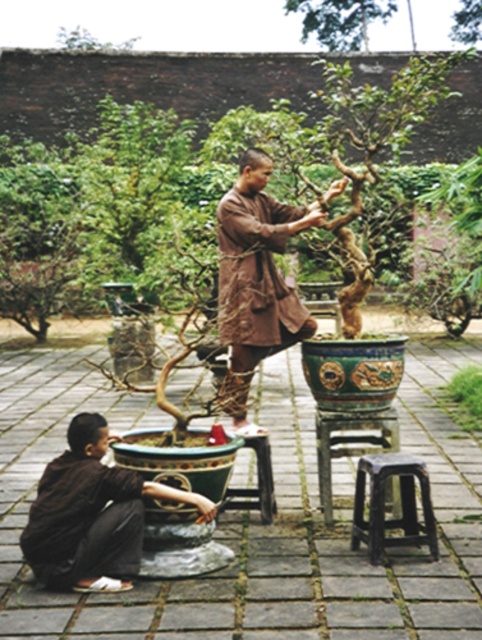
Question: Which of the following is the farthest from the observer?

Choices:
 (A) black plastic stool at lower center
 (B) brown matte/soft monk at center

Answer: (B)

Question: Which point is farther to the camera?

Choices:
 (A) (413, 467)
 (B) (53, 576)
 (C) (254, 451)

Answer: (C)

Question: Is black plastic stool at center positioned in front of wooden stool at center?

Choices:
 (A) yes
 (B) no

Answer: (B)

Question: Can you confirm if green glossy tree at upper center is thinner than wooden stool at center?

Choices:
 (A) yes
 (B) no

Answer: (B)

Question: Which object is closer to the camera taking this photo?

Choices:
 (A) matte brown robe at lower left
 (B) black plastic stool at center

Answer: (A)

Question: Is matte brown robe at lower left behind brown cotton robe at lower left?

Choices:
 (A) no
 (B) yes

Answer: (B)